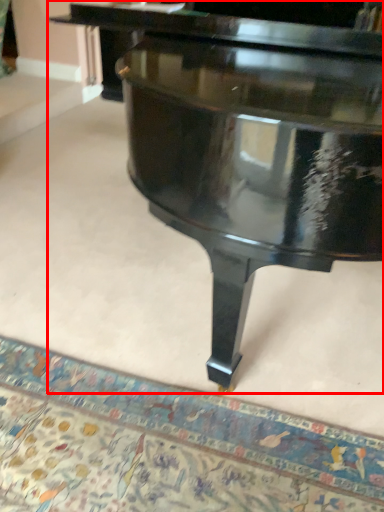
Question: Considering the relative positions of piano (annotated by the red box) and mat in the image provided, where is piano (annotated by the red box) located with respect to the staircase?

Choices:
 (A) right
 (B) left

Answer: (A)